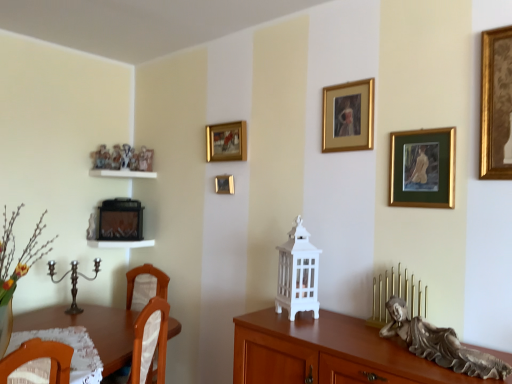
Find the location of a particular element. vacant space situated on the left part of gold metallic candle holder at lower right, arranged as the 1th candle holder when viewed from the right is located at coordinates (351, 331).